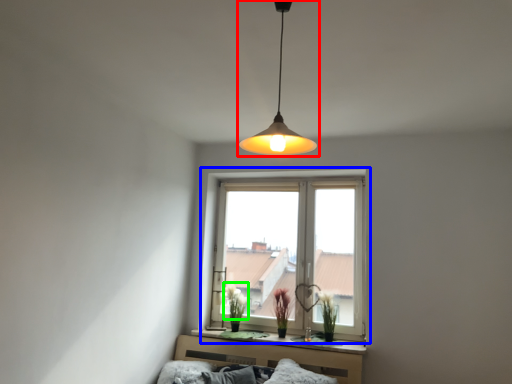
Question: Based on their relative distances, which object is farther from lamp (highlighted by a red box)? Choose from window (highlighted by a blue box) and flower (highlighted by a green box).

Choices:
 (A) window
 (B) flower

Answer: (B)